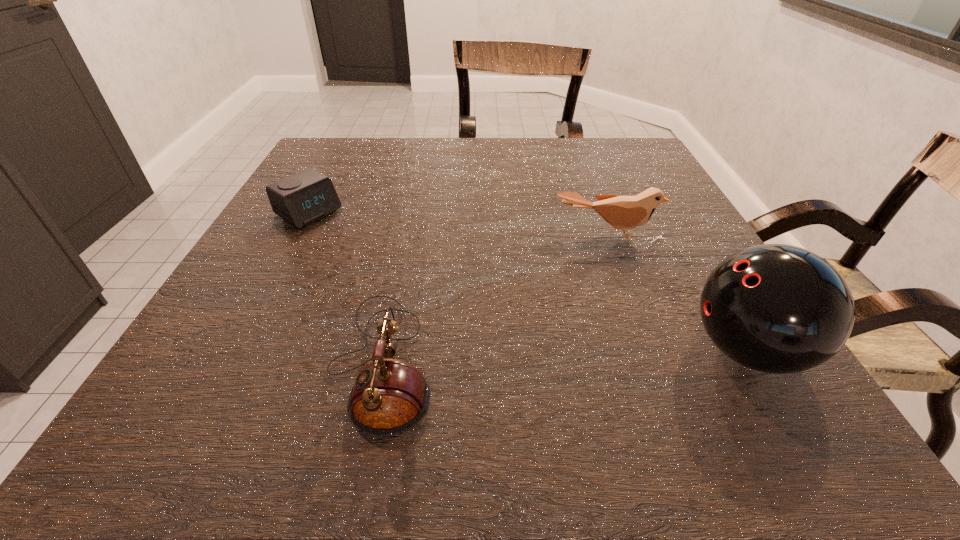
Find the location of a particular element. This screenshot has width=960, height=540. vacant spot on the desktop that is between the telephone and the tallest object and is positioned on the front-facing side of the leftmost object is located at coordinates (552, 356).

The width and height of the screenshot is (960, 540). I want to click on vacant space on the desktop that is between the second object from left to right and the tallest object and is positioned at the beak of the bird, so click(616, 354).